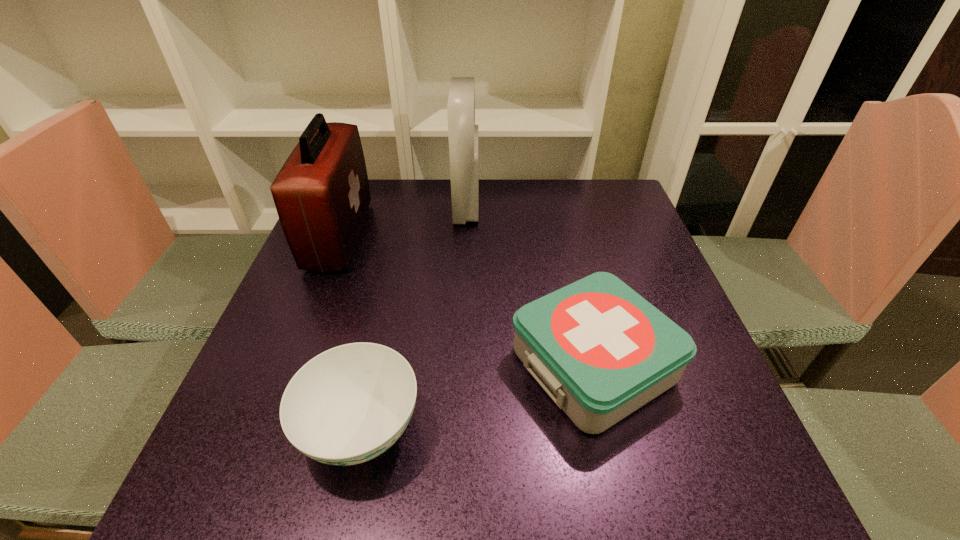
Identify the location of the third object from left to right. (462, 132).

Where is `the leftmost object`? The height and width of the screenshot is (540, 960). the leftmost object is located at coordinates (321, 194).

Locate an element on the screen. The image size is (960, 540). the rightmost object is located at coordinates (601, 351).

Locate an element on the screen. This screenshot has width=960, height=540. the rightmost first-aid kit is located at coordinates (601, 351).

The height and width of the screenshot is (540, 960). Identify the location of chinaware. (349, 404).

Where is `free spot located on the front-facing side of the third object from left to right`? This screenshot has width=960, height=540. free spot located on the front-facing side of the third object from left to right is located at coordinates (579, 207).

In order to click on vacant space located 0.090m on the side of the leftmost object with the cross symbol in this screenshot , I will do `click(399, 235)`.

Locate an element on the screen. The height and width of the screenshot is (540, 960). vacant area located 0.220m on the left of the rightmost object is located at coordinates (395, 364).

Find the location of `free location located on the back of the second object from left to right`. free location located on the back of the second object from left to right is located at coordinates (390, 298).

Locate an element on the screen. object that is positioned at the near edge is located at coordinates (349, 404).